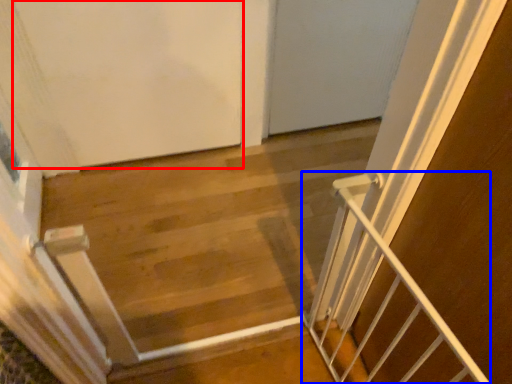
Question: Among these objects, which one is nearest to the camera, door (highlighted by a red box) or stairs (highlighted by a blue box)?

Choices:
 (A) door
 (B) stairs

Answer: (B)